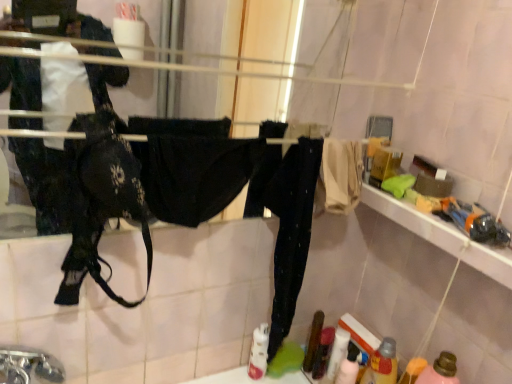
Question: From the image's perspective, is pink matte bottle at lower right, which is counted as the 2th bottle, starting from the left, beneath silver metallic faucet at lower left?

Choices:
 (A) no
 (B) yes

Answer: (B)

Question: From a real-world perspective, does pink matte bottle at lower right, which is counted as the 2th bottle, starting from the left, stand above silver metallic faucet at lower left?

Choices:
 (A) yes
 (B) no

Answer: (B)

Question: Is pink matte bottle at lower right, placed as the first bottle when sorted from right to left, behind silver metallic faucet at lower left?

Choices:
 (A) yes
 (B) no

Answer: (A)

Question: Is pink matte bottle at lower right, placed as the first bottle when sorted from right to left, aimed at silver metallic faucet at lower left?

Choices:
 (A) yes
 (B) no

Answer: (B)

Question: Is the depth of pink matte bottle at lower right, which is counted as the 2th bottle, starting from the left, less than that of silver metallic faucet at lower left?

Choices:
 (A) yes
 (B) no

Answer: (B)

Question: Is pink matte bottle at lower right, placed as the first bottle when sorted from right to left, looking in the opposite direction of silver metallic faucet at lower left?

Choices:
 (A) no
 (B) yes

Answer: (A)

Question: Is silver metallic faucet at lower left taller than pink matte bottle at lower right, placed as the first bottle when sorted from right to left?

Choices:
 (A) no
 (B) yes

Answer: (A)

Question: Is silver metallic faucet at lower left looking in the opposite direction of pink matte bottle at lower right, placed as the first bottle when sorted from right to left?

Choices:
 (A) no
 (B) yes

Answer: (A)

Question: From the image's perspective, would you say silver metallic faucet at lower left is shown under pink matte bottle at lower right, which is counted as the 2th bottle, starting from the left?

Choices:
 (A) yes
 (B) no

Answer: (B)

Question: Does silver metallic faucet at lower left have a smaller size compared to pink matte bottle at lower right, placed as the first bottle when sorted from right to left?

Choices:
 (A) yes
 (B) no

Answer: (B)

Question: Considering the relative sizes of silver metallic faucet at lower left and pink matte bottle at lower right, placed as the first bottle when sorted from right to left, in the image provided, is silver metallic faucet at lower left shorter than pink matte bottle at lower right, placed as the first bottle when sorted from right to left,?

Choices:
 (A) no
 (B) yes

Answer: (B)

Question: Considering the relative sizes of silver metallic faucet at lower left and pink matte bottle at lower right, placed as the first bottle when sorted from right to left, in the image provided, is silver metallic faucet at lower left thinner than pink matte bottle at lower right, placed as the first bottle when sorted from right to left,?

Choices:
 (A) yes
 (B) no

Answer: (B)

Question: Is translucent plastic bottle at lower right, positioned as the 1th bottle in left-to-right order, taller than pink matte bottle at lower right, placed as the first bottle when sorted from right to left?

Choices:
 (A) yes
 (B) no

Answer: (B)